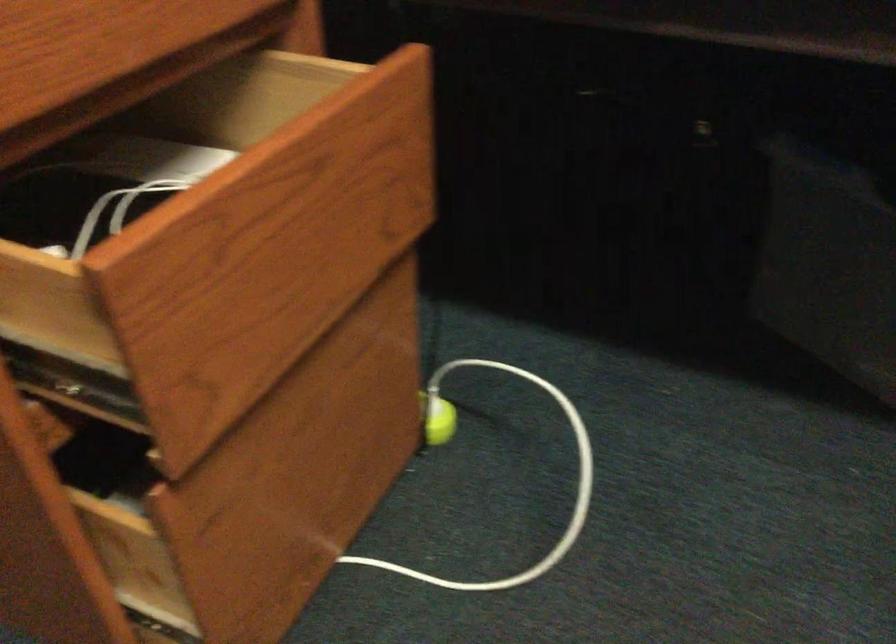
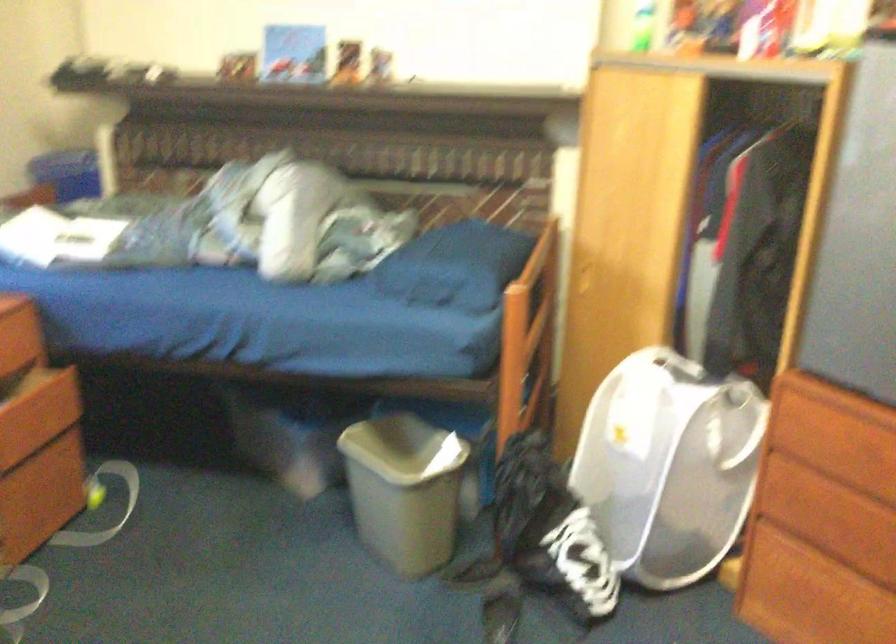
Question: The images are taken continuously from a first-person perspective. In which direction are you moving?

Choices:
 (A) Left
 (B) Right
 (C) Forward
 (D) Backward

Answer: (D)